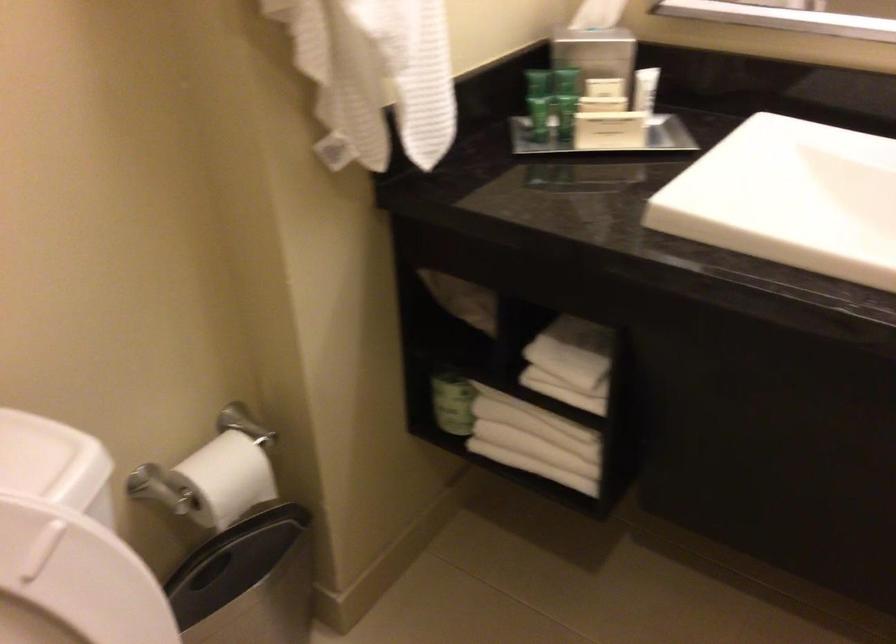
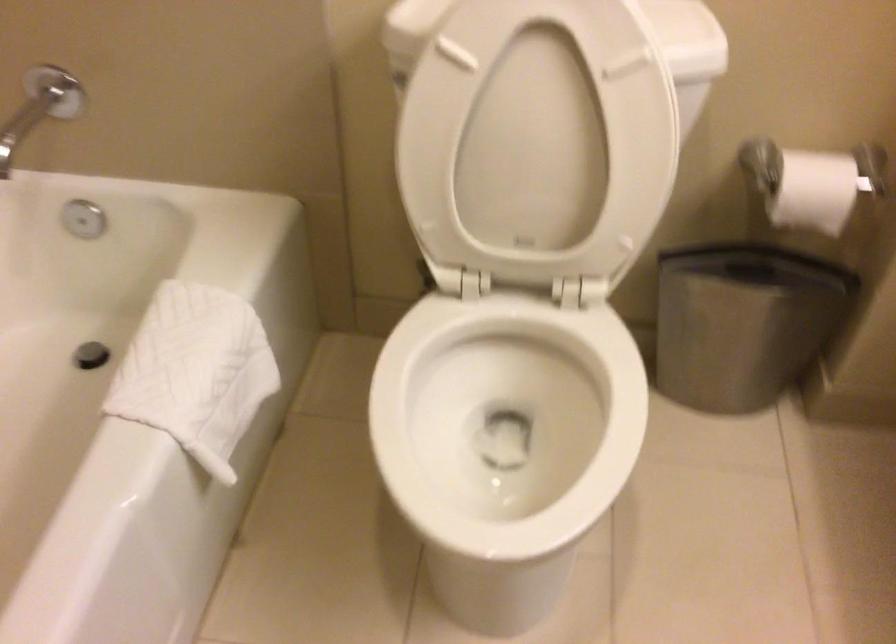
Find the pixel in the second image that matches pixel 233 482 in the first image.

(812, 183)